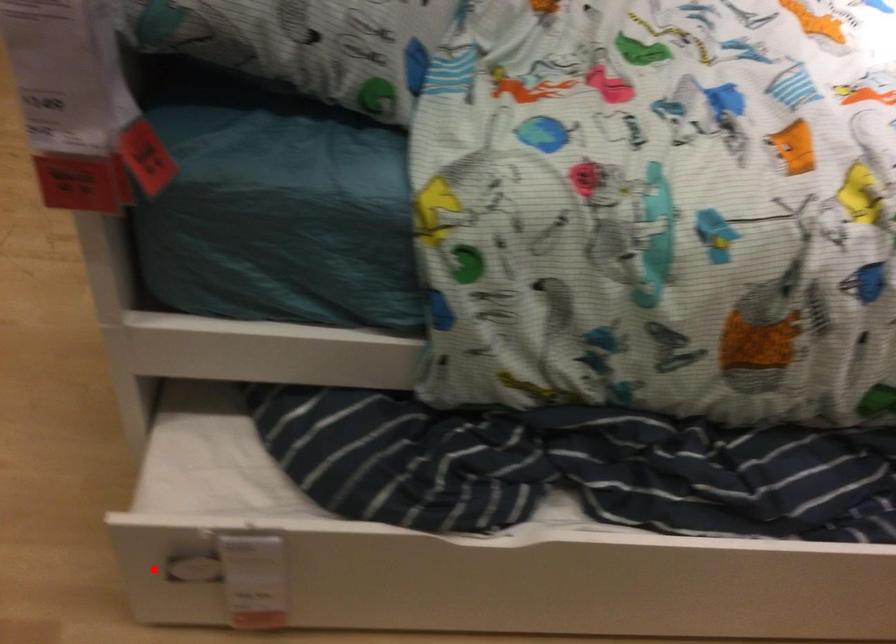
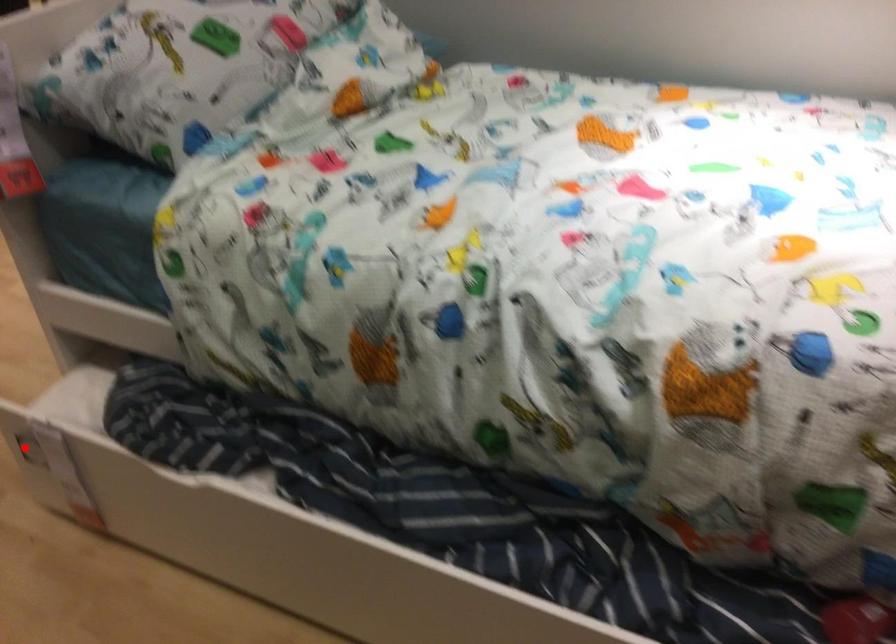
In the scene shown: I am providing you with two images of the same scene from different viewpoints. A red point is marked on the first image and another point is marked on the second image. Is the marked point in image1 the same physical position as the marked point in image2?

Yes